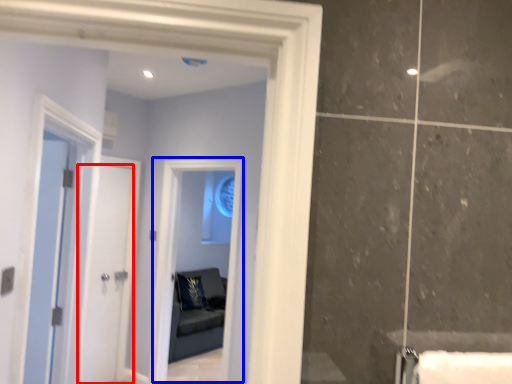
Question: Which object is closer to the camera taking this photo, door (highlighted by a red box) or window (highlighted by a blue box)?

Choices:
 (A) door
 (B) window

Answer: (B)